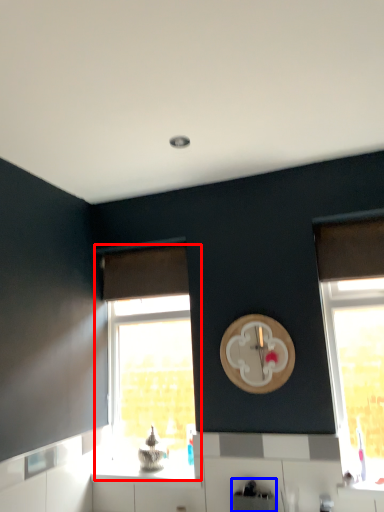
Question: Among these objects, which one is farthest to the camera, window (highlighted by a red box) or appliance (highlighted by a blue box)?

Choices:
 (A) window
 (B) appliance

Answer: (A)